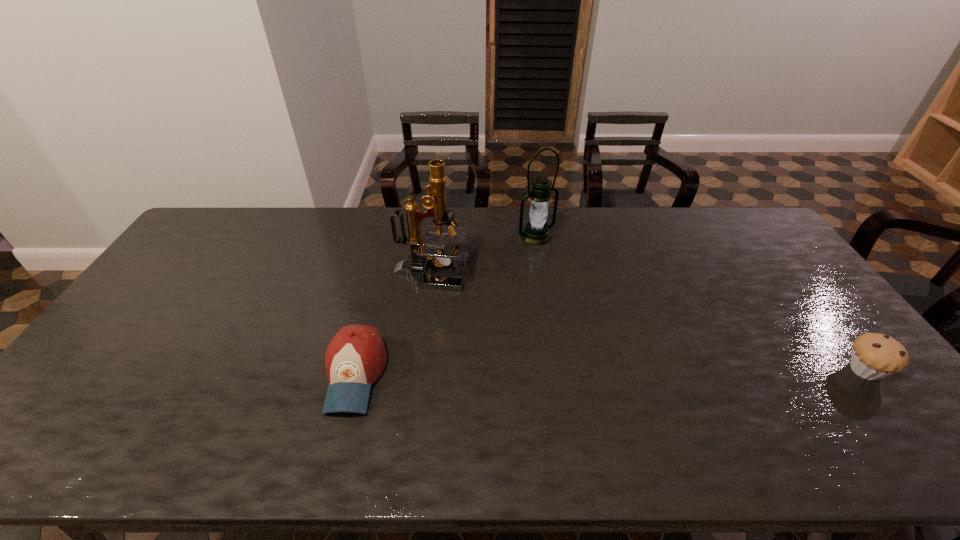
I want to click on free space on the desktop that is between the baseball cap and the muffin and is positioned at the eyepiece of the microscope, so click(677, 372).

Where is `free spot on the desktop that is between the baseball cap and the muffin and is positioned on the side where the lantern emits light`? free spot on the desktop that is between the baseball cap and the muffin and is positioned on the side where the lantern emits light is located at coordinates (669, 372).